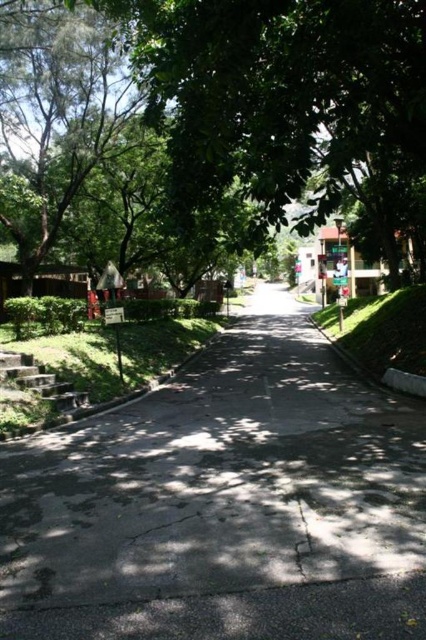
Based on the photo, you are standing at the center of the pathway and want to reach the gray concrete pavement at lower left. Which direction should you walk to get there?

You should walk to the lower left direction to reach the gray concrete pavement at lower left.

From the picture: You are standing on the gray concrete pavement at lower left and want to walk towards the green leafy tree at upper left. Which direction should you move to get closer to the tree?

The gray concrete pavement at lower left is closer to the viewer than the green leafy tree at upper left. To move towards the tree, you should walk forward along the path as the tree is positioned further away from your current position.

Looking at this image, you are a delivery person with a cart that is 3 feet wide. You need to navigate along the gray concrete pavement at lower left to reach the entrance near the bushes. There is a green leafy tree at upper left blocking the path. Is there enough space between the tree and the pavement to move your cart through?

The distance between the gray concrete pavement at lower left and the green leafy tree at upper left is 23.06 feet. Since your cart is only 3 feet wide, there is ample space to navigate through the path without any obstruction.